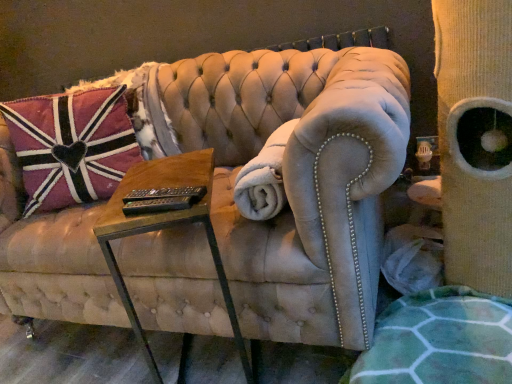
Locate an element on the screen. The height and width of the screenshot is (384, 512). empty space that is ontop of woodenmaterial/texturetable at center (from a real-world perspective) is located at coordinates (155, 176).